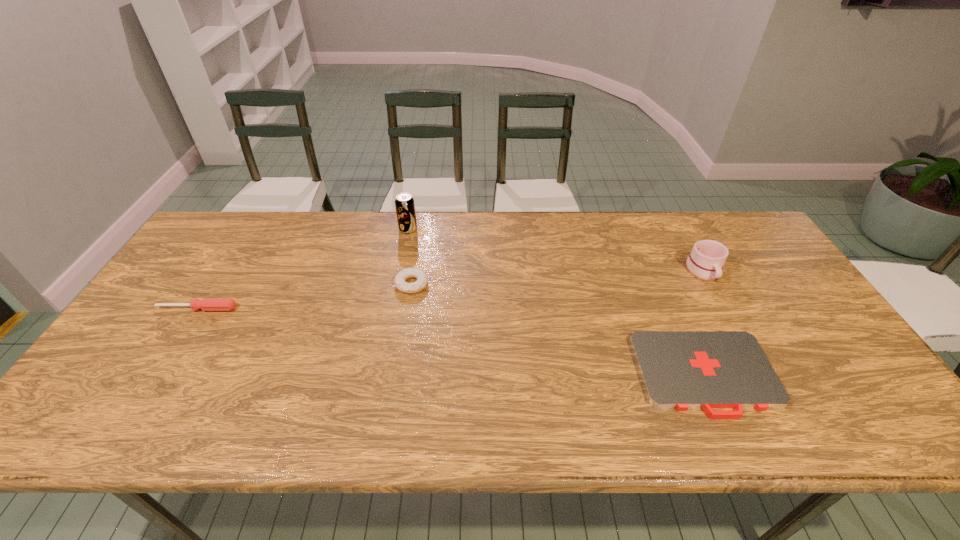
Identify the location of free space at the far right corner. The width and height of the screenshot is (960, 540). (737, 253).

Where is `free space at the near right corner`? The width and height of the screenshot is (960, 540). free space at the near right corner is located at coordinates (864, 414).

The width and height of the screenshot is (960, 540). In order to click on vacant area between the soda can and the mug in this screenshot , I will do `click(556, 250)`.

Where is `free space between the soda can and the shortest object`? free space between the soda can and the shortest object is located at coordinates (557, 302).

The width and height of the screenshot is (960, 540). Identify the location of empty space between the leftmost object and the mug. (450, 290).

Locate an element on the screen. The image size is (960, 540). empty space between the fourth shortest object and the farthest object is located at coordinates (556, 250).

This screenshot has height=540, width=960. I want to click on free area in between the doughnut and the first-aid kit, so click(x=559, y=329).

Where is `vacant area that lies between the tallest object and the second tallest object`? vacant area that lies between the tallest object and the second tallest object is located at coordinates (556, 250).

Find the location of `vacant space that is in between the fourth shortest object and the shortest object`. vacant space that is in between the fourth shortest object and the shortest object is located at coordinates (705, 323).

Locate an element on the screen. blank region between the doughnut and the soda can is located at coordinates click(x=410, y=256).